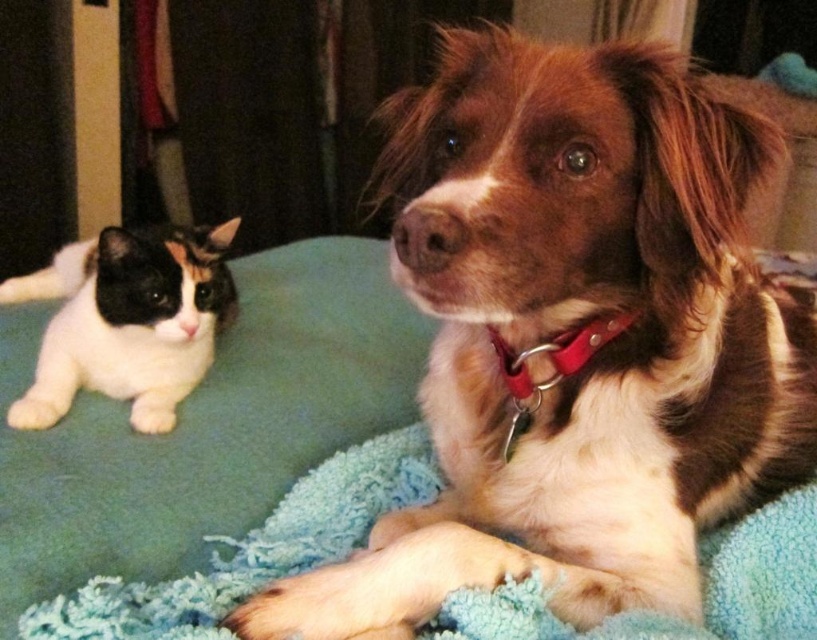
Does blue textured blanket at lower center come behind red leather collar at center?

No, blue textured blanket at lower center is in front of red leather collar at center.

Which is behind, point (39, 611) or point (583, 340)?

The point (583, 340) is more distant.

Identify the location of blue textured blanket at lower center. Image resolution: width=817 pixels, height=640 pixels. (253, 548).

This screenshot has width=817, height=640. What do you see at coordinates (570, 328) in the screenshot?
I see `brown furry dog at center` at bounding box center [570, 328].

In the scene shown: Is brown furry dog at center to the left of blue textured blanket at lower center from the viewer's perspective?

No, brown furry dog at center is not to the left of blue textured blanket at lower center.

Identify the location of brown furry dog at center. (570, 328).

Between point (83, 278) and point (559, 380), which one is positioned in front?

Point (559, 380)

Is white fur cat at left positioned behind red leather collar at center?

Yes.

Is point (146, 328) farther from viewer compared to point (532, 406)?

Yes, it is behind point (532, 406).

The width and height of the screenshot is (817, 640). Identify the location of white fur cat at left. (127, 321).